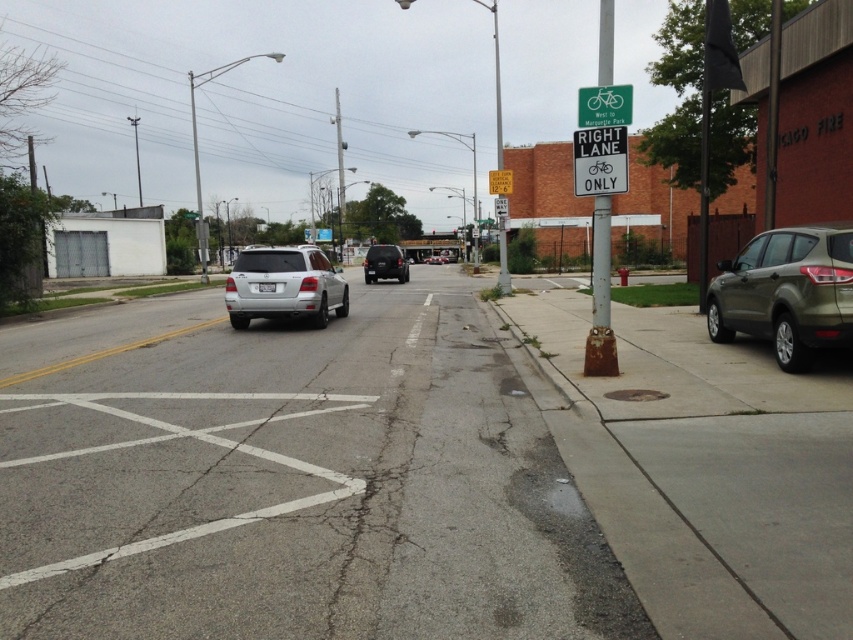
Which is below, white plastic sign at right lane or green plastic sign at upper center?

Positioned lower is white plastic sign at right lane.

The image size is (853, 640). In order to click on white plastic sign at right lane in this screenshot , I will do `click(601, 161)`.

Does point (621, 163) lie behind point (613, 108)?

Yes, point (621, 163) is farther from viewer.

At what (x,y) coordinates should I click in order to perform the action: click on white plastic sign at right lane. Please return your answer as a coordinate pair (x, y). The width and height of the screenshot is (853, 640). Looking at the image, I should click on (601, 161).

Is satin silver suv at center above shiny black suv at center?

Actually, satin silver suv at center is below shiny black suv at center.

Describe the element at coordinates (283, 285) in the screenshot. Image resolution: width=853 pixels, height=640 pixels. I see `satin silver suv at center` at that location.

Find the location of a particular element. The height and width of the screenshot is (640, 853). satin silver suv at center is located at coordinates (283, 285).

Does point (257, 285) come in front of point (619, 140)?

No.

Does satin silver suv at center come in front of white plastic sign at right lane?

No, satin silver suv at center is behind white plastic sign at right lane.

Where is `satin silver suv at center`? Image resolution: width=853 pixels, height=640 pixels. satin silver suv at center is located at coordinates (283, 285).